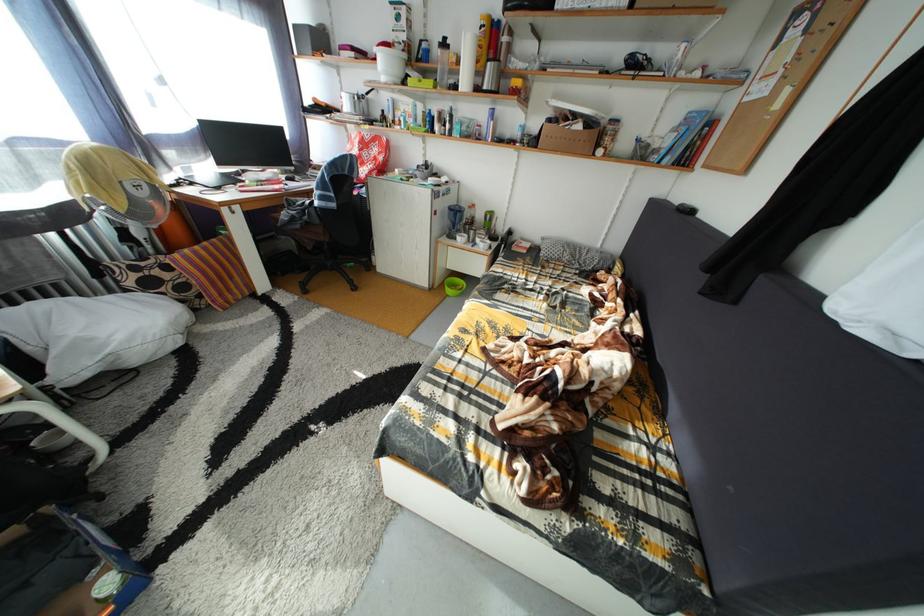
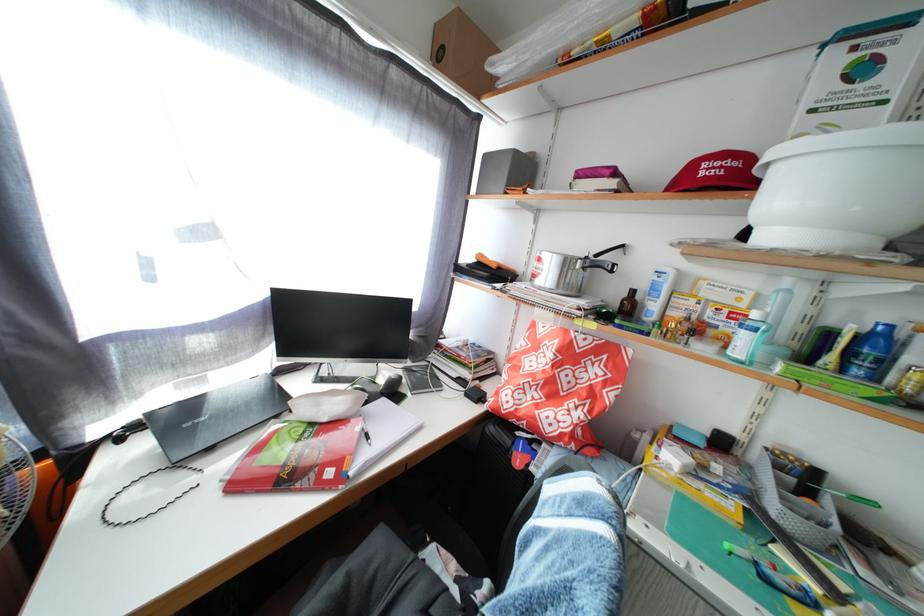
Locate, in the second image, the point that corresponds to point (377, 144) in the first image.

(590, 350)